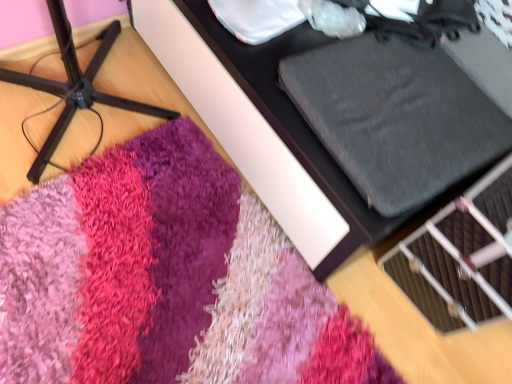
Question: Considering the positions of shaggy carpet at lower left, arranged as the second furniture when viewed from the right, and textured gray cushion at upper right, arranged as the 1th furniture when viewed from the right, in the image, is shaggy carpet at lower left, arranged as the second furniture when viewed from the right, bigger or smaller than textured gray cushion at upper right, arranged as the 1th furniture when viewed from the right,?

Choices:
 (A) big
 (B) small

Answer: (B)

Question: Which is correct: shaggy carpet at lower left, the 1th furniture positioned from the left, is inside textured gray cushion at upper right, arranged as the 1th furniture when viewed from the right, or outside of it?

Choices:
 (A) inside
 (B) outside

Answer: (B)

Question: Which is nearer to the shaggy carpet at lower left, the 1th furniture positioned from the left?

Choices:
 (A) textured gray cushion at upper right, arranged as the 1th furniture when viewed from the right
 (B) shaggy pink rug at lower center

Answer: (A)

Question: Which of these objects is positioned farthest from the textured gray cushion at upper right, the 2th furniture positioned from the left?

Choices:
 (A) shaggy carpet at lower left, arranged as the second furniture when viewed from the right
 (B) shaggy pink rug at lower center

Answer: (A)